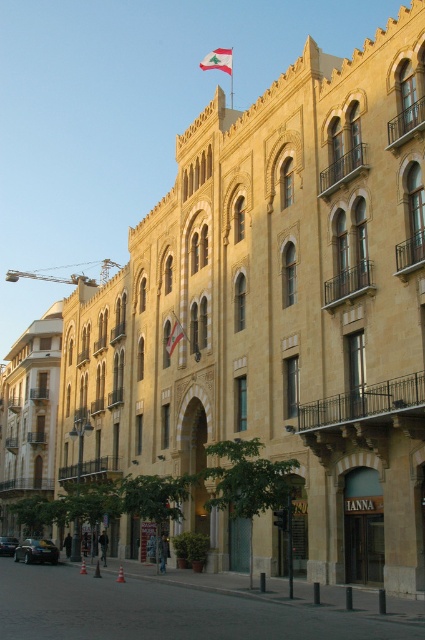
Question: Among these objects, which one is farthest from the camera?

Choices:
 (A) red fabric flag at upper center
 (B) shiny black car at lower left

Answer: (A)

Question: Where is red fabric flag at upper center located in relation to white fabric flag at center in the image?

Choices:
 (A) left
 (B) right

Answer: (B)

Question: Which point is closer to the camera?

Choices:
 (A) shiny black car at lower left
 (B) white fabric flag at center

Answer: (B)

Question: Is shiny black car at lower left below shiny black sedan at center?

Choices:
 (A) no
 (B) yes

Answer: (A)

Question: Can you confirm if red fabric flag at upper center is wider than white fabric flag at center?

Choices:
 (A) yes
 (B) no

Answer: (A)

Question: Which point is closer to the camera taking this photo?

Choices:
 (A) (172, 332)
 (B) (2, 540)
 (C) (31, 547)

Answer: (A)